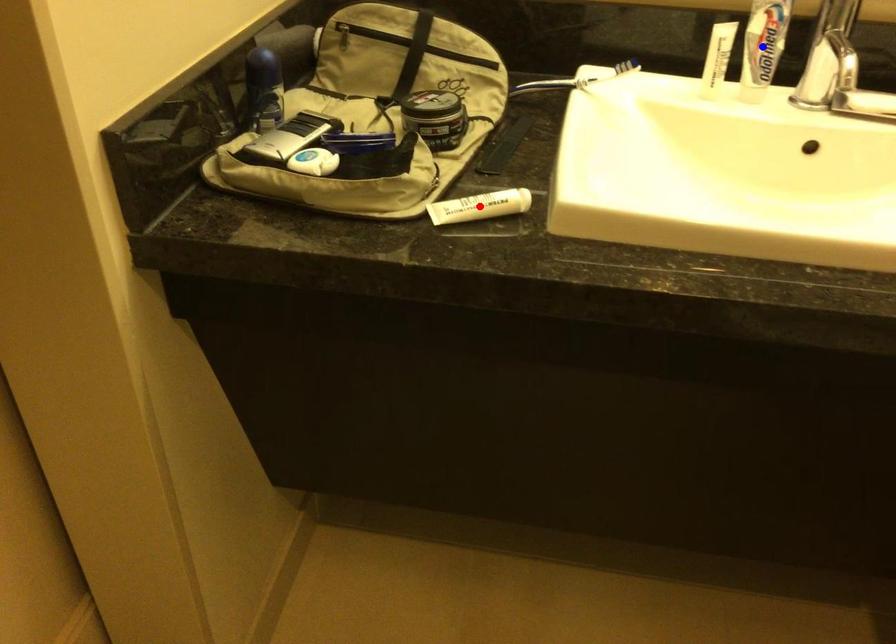
Question: Two points are marked on the image. Which point is closer to the camera?

Choices:
 (A) Blue point is closer.
 (B) Red point is closer.

Answer: (B)